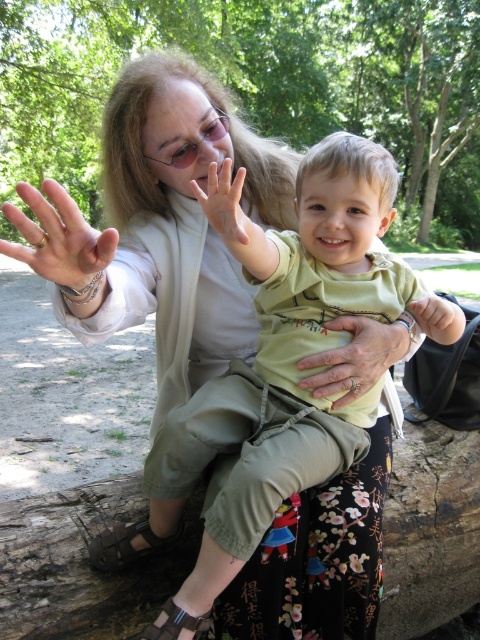
The image size is (480, 640). What do you see at coordinates (276, 378) in the screenshot?
I see `green matte shirt at center` at bounding box center [276, 378].

Is green matte shirt at center bigger than matte skin hand at center?

Correct, green matte shirt at center is larger in size than matte skin hand at center.

The height and width of the screenshot is (640, 480). I want to click on green matte shirt at center, so click(276, 378).

The width and height of the screenshot is (480, 640). Identify the location of green matte shirt at center. (276, 378).

How far apart are green matte shirt at center and matte gold ring at center?

20.82 inches

You are a GUI agent. You are given a task and a screenshot of the screen. Output one action in this format:
    pyautogui.click(x=<x>, y=<y>)
    Task: Click on the green matte shirt at center
    The image size is (480, 640).
    Given the screenshot: What is the action you would take?
    pyautogui.click(x=276, y=378)

Who is more distant from viewer, (x=311, y=384) or (x=219, y=166)?

The point (x=219, y=166) is more distant.

Where is `gold textured ring at center`? gold textured ring at center is located at coordinates (354, 358).